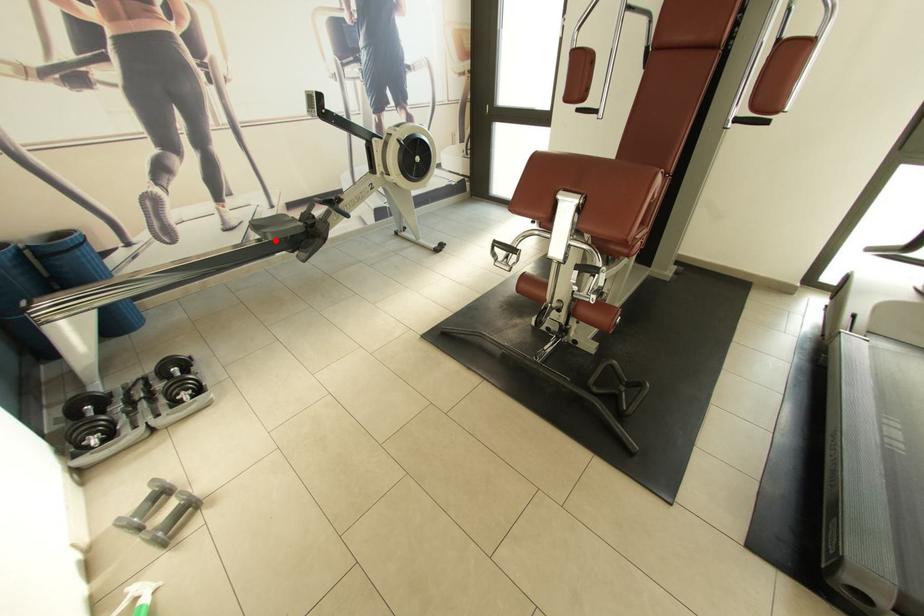
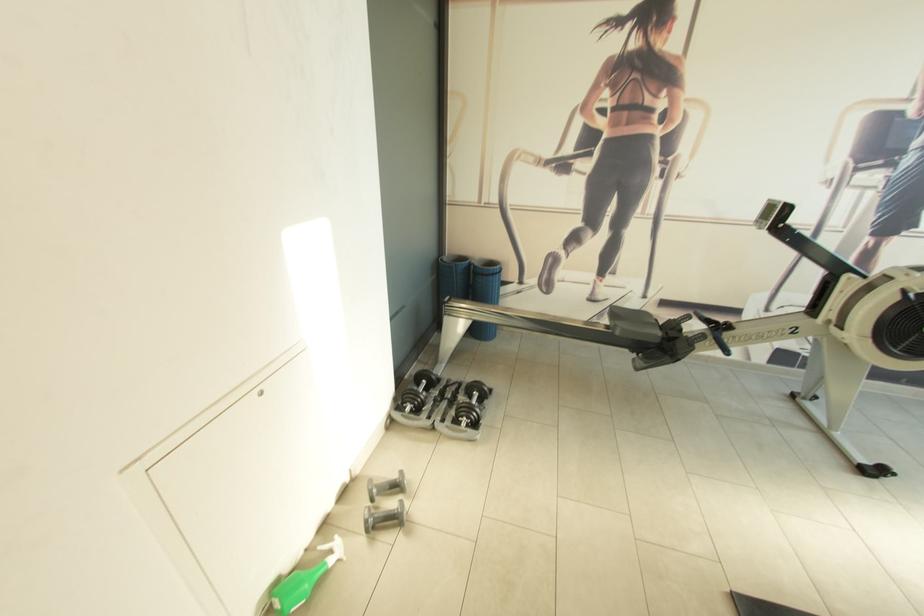
In the second image, find the point that corresponds to the highlighted location in the first image.

(622, 334)